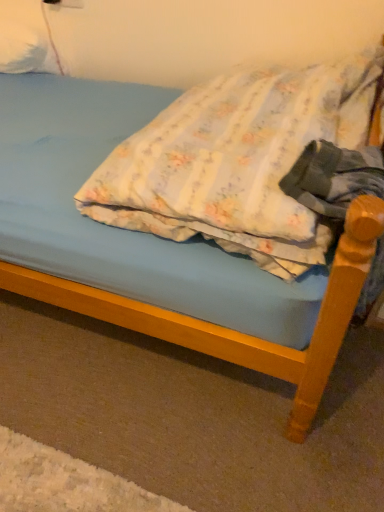
This screenshot has width=384, height=512. What do you see at coordinates (239, 161) in the screenshot? I see `floral fabric pillow at center, positioned as the first pillow in front-to-back order` at bounding box center [239, 161].

Identify the location of floral fabric pillow at center, which is the 1th pillow in right-to-left order. (239, 161).

How much space does floral fabric pillow at center, the second pillow in the left-to-right sequence, occupy horizontally?

It is 24.05 inches.

Measure the distance between white fluffy pillow at upper left, positioned as the second pillow in bottom-to-top order, and camera.

white fluffy pillow at upper left, positioned as the second pillow in bottom-to-top order, and camera are 1.65 meters apart.

Describe the element at coordinates (26, 38) in the screenshot. I see `white fluffy pillow at upper left, positioned as the second pillow in bottom-to-top order` at that location.

You are a GUI agent. You are given a task and a screenshot of the screen. Output one action in this format:
    pyautogui.click(x=<x>, y=<y>)
    Task: Click on the white fluffy pillow at upper left, which is the 1th pillow in left-to-right order
    The width and height of the screenshot is (384, 512).
    Given the screenshot: What is the action you would take?
    pyautogui.click(x=26, y=38)

Find the location of a particular element. The image size is (384, 512). floral fabric pillow at center, positioned as the first pillow in front-to-back order is located at coordinates (x=239, y=161).

Which is more to the left, floral fabric pillow at center, which is the 1th pillow in right-to-left order, or white fluffy pillow at upper left, which is counted as the first pillow, starting from the top?

Positioned to the left is white fluffy pillow at upper left, which is counted as the first pillow, starting from the top.

Who is more distant, floral fabric pillow at center, positioned as the first pillow in front-to-back order, or white fluffy pillow at upper left, positioned as the second pillow in bottom-to-top order?

white fluffy pillow at upper left, positioned as the second pillow in bottom-to-top order, is further from the camera.

Is point (108, 211) farther from camera compared to point (34, 11)?

No, (108, 211) is in front of (34, 11).

From the image's perspective, is floral fabric pillow at center, which is the 1th pillow in right-to-left order, beneath white fluffy pillow at upper left, positioned as the second pillow in bottom-to-top order?

Correct, floral fabric pillow at center, which is the 1th pillow in right-to-left order, appears lower than white fluffy pillow at upper left, positioned as the second pillow in bottom-to-top order, in the image.

Looking at this image, from a real-world perspective, is floral fabric pillow at center, the first pillow ordered from the bottom, positioned over white fluffy pillow at upper left, which is the second pillow from right to left, based on gravity?

No, from a real-world perspective, floral fabric pillow at center, the first pillow ordered from the bottom, is not on top of white fluffy pillow at upper left, which is the second pillow from right to left.

Which of these two, floral fabric pillow at center, positioned as the first pillow in front-to-back order, or white fluffy pillow at upper left, positioned as the second pillow in bottom-to-top order, is wider?

With larger width is floral fabric pillow at center, positioned as the first pillow in front-to-back order.

Which of these two, floral fabric pillow at center, positioned as the first pillow in front-to-back order, or white fluffy pillow at upper left, which is counted as the first pillow, starting from the top, stands shorter?

Standing shorter between the two is white fluffy pillow at upper left, which is counted as the first pillow, starting from the top.

Who is bigger, floral fabric pillow at center, which is the 1th pillow in right-to-left order, or white fluffy pillow at upper left, which is the 1th pillow in left-to-right order?

With larger size is floral fabric pillow at center, which is the 1th pillow in right-to-left order.

Would you say floral fabric pillow at center, the second pillow in the left-to-right sequence, is outside white fluffy pillow at upper left, positioned as the second pillow in bottom-to-top order?

floral fabric pillow at center, the second pillow in the left-to-right sequence, lies outside white fluffy pillow at upper left, positioned as the second pillow in bottom-to-top order,'s area.

Is floral fabric pillow at center, positioned as the first pillow in front-to-back order, not close to white fluffy pillow at upper left, which is the second pillow from right to left?

floral fabric pillow at center, positioned as the first pillow in front-to-back order, is positioned a significant distance from white fluffy pillow at upper left, which is the second pillow from right to left.

Is floral fabric pillow at center, acting as the second pillow starting from the back, facing away from white fluffy pillow at upper left, which appears as the first pillow when viewed from the back?

floral fabric pillow at center, acting as the second pillow starting from the back, is not turned away from white fluffy pillow at upper left, which appears as the first pillow when viewed from the back.

At what (x,y) coordinates should I click in order to perform the action: click on pillow on the right of the white fluffy pillow at upper left, which is counted as the first pillow, starting from the top. Please return your answer as a coordinate pair (x, y). Looking at the image, I should click on (239, 161).

Is white fluffy pillow at upper left, which is counted as the first pillow, starting from the top, to the left or to the right of floral fabric pillow at center, the second pillow in the left-to-right sequence, in the image?

Based on their positions, white fluffy pillow at upper left, which is counted as the first pillow, starting from the top, is located to the left of floral fabric pillow at center, the second pillow in the left-to-right sequence.

Which object is further away from the camera taking this photo, white fluffy pillow at upper left, positioned as the second pillow in bottom-to-top order, or floral fabric pillow at center, the second pillow in the left-to-right sequence?

white fluffy pillow at upper left, positioned as the second pillow in bottom-to-top order, is more distant.

Between point (11, 22) and point (200, 210), which one is positioned behind?

The point (11, 22) is farther.

In the scene shown: From the image's perspective, which object appears higher, white fluffy pillow at upper left, which is the second pillow from right to left, or floral fabric pillow at center, the second pillow in the left-to-right sequence?

white fluffy pillow at upper left, which is the second pillow from right to left, is shown above in the image.

Based on the photo, from a real-world perspective, is white fluffy pillow at upper left, which is the second pillow from right to left, beneath floral fabric pillow at center, which is counted as the second pillow, starting from the top?

No, from a real-world perspective, white fluffy pillow at upper left, which is the second pillow from right to left, is not under floral fabric pillow at center, which is counted as the second pillow, starting from the top.

Considering the relative sizes of white fluffy pillow at upper left, which is the second pillow from right to left, and floral fabric pillow at center, acting as the second pillow starting from the back, in the image provided, is white fluffy pillow at upper left, which is the second pillow from right to left, wider than floral fabric pillow at center, acting as the second pillow starting from the back,?

Incorrect, the width of white fluffy pillow at upper left, which is the second pillow from right to left, does not surpass that of floral fabric pillow at center, acting as the second pillow starting from the back.

Is white fluffy pillow at upper left, which is the 1th pillow in left-to-right order, taller than floral fabric pillow at center, acting as the second pillow starting from the back?

In fact, white fluffy pillow at upper left, which is the 1th pillow in left-to-right order, may be shorter than floral fabric pillow at center, acting as the second pillow starting from the back.

Considering the sizes of objects white fluffy pillow at upper left, which is counted as the first pillow, starting from the top, and floral fabric pillow at center, positioned as the first pillow in front-to-back order, in the image provided, who is bigger, white fluffy pillow at upper left, which is counted as the first pillow, starting from the top, or floral fabric pillow at center, positioned as the first pillow in front-to-back order,?

Bigger between the two is floral fabric pillow at center, positioned as the first pillow in front-to-back order.

Can we say white fluffy pillow at upper left, which is the second pillow from right to left, lies outside floral fabric pillow at center, which is the 1th pillow in right-to-left order?

Indeed, white fluffy pillow at upper left, which is the second pillow from right to left, is completely outside floral fabric pillow at center, which is the 1th pillow in right-to-left order.

Is the surface of white fluffy pillow at upper left, which is the 1th pillow in left-to-right order, in direct contact with floral fabric pillow at center, the first pillow ordered from the bottom?

No, white fluffy pillow at upper left, which is the 1th pillow in left-to-right order, is not beside floral fabric pillow at center, the first pillow ordered from the bottom.

Could you tell me if white fluffy pillow at upper left, which is the 1th pillow in left-to-right order, is facing floral fabric pillow at center, positioned as the first pillow in front-to-back order?

No, white fluffy pillow at upper left, which is the 1th pillow in left-to-right order, is not oriented towards floral fabric pillow at center, positioned as the first pillow in front-to-back order.

Looking at this image, how many degrees apart are the facing directions of white fluffy pillow at upper left, positioned as the second pillow in bottom-to-top order, and floral fabric pillow at center, positioned as the first pillow in front-to-back order?

white fluffy pillow at upper left, positioned as the second pillow in bottom-to-top order, and floral fabric pillow at center, positioned as the first pillow in front-to-back order, are facing 93.8 degrees away from each other.

Measure the distance between white fluffy pillow at upper left, positioned as the second pillow in bottom-to-top order, and floral fabric pillow at center, which is counted as the second pillow, starting from the top.

A distance of 1.02 meters exists between white fluffy pillow at upper left, positioned as the second pillow in bottom-to-top order, and floral fabric pillow at center, which is counted as the second pillow, starting from the top.

At what (x,y) coordinates should I click in order to perform the action: click on pillow above the floral fabric pillow at center, the second pillow in the left-to-right sequence (from the image's perspective). Please return your answer as a coordinate pair (x, y). The height and width of the screenshot is (512, 384). Looking at the image, I should click on (26, 38).

At what (x,y) coordinates should I click in order to perform the action: click on pillow above the floral fabric pillow at center, the first pillow ordered from the bottom (from a real-world perspective). Please return your answer as a coordinate pair (x, y). Looking at the image, I should click on (26, 38).

Find the location of a particular element. The image size is (384, 512). pillow that is on the right side of white fluffy pillow at upper left, which is counted as the first pillow, starting from the top is located at coordinates (239, 161).